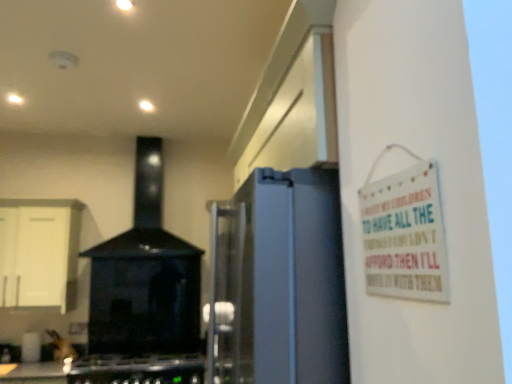
Question: Is black glossy stove at center beside black matte gas stove at lower left?

Choices:
 (A) no
 (B) yes

Answer: (A)

Question: Does black glossy stove at center have a lesser width compared to black matte gas stove at lower left?

Choices:
 (A) no
 (B) yes

Answer: (B)

Question: Is black glossy stove at center outside black matte gas stove at lower left?

Choices:
 (A) yes
 (B) no

Answer: (A)

Question: Can you confirm if black glossy stove at center is bigger than black matte gas stove at lower left?

Choices:
 (A) no
 (B) yes

Answer: (B)

Question: Is the depth of black glossy stove at center greater than that of black matte gas stove at lower left?

Choices:
 (A) yes
 (B) no

Answer: (A)

Question: Looking at their shapes, would you say black glossy stove at center is wider or thinner than black matte gas stove at lower left?

Choices:
 (A) thin
 (B) wide

Answer: (A)

Question: Considering the positions of black glossy stove at center and black matte gas stove at lower left in the image, is black glossy stove at center bigger or smaller than black matte gas stove at lower left?

Choices:
 (A) big
 (B) small

Answer: (A)

Question: Is black glossy stove at center taller or shorter than black matte gas stove at lower left?

Choices:
 (A) tall
 (B) short

Answer: (A)

Question: In the image, is black glossy stove at center on the left side or the right side of black matte gas stove at lower left?

Choices:
 (A) right
 (B) left

Answer: (B)

Question: Considering the positions of point (114, 362) and point (139, 286), is point (114, 362) closer or farther from the camera than point (139, 286)?

Choices:
 (A) closer
 (B) farther

Answer: (A)

Question: From their relative heights in the image, would you say black matte gas stove at lower left is taller or shorter than black glossy stove at center?

Choices:
 (A) short
 (B) tall

Answer: (A)

Question: Is black matte gas stove at lower left spatially inside black glossy stove at center, or outside of it?

Choices:
 (A) outside
 (B) inside

Answer: (A)

Question: From the image's perspective, is black matte gas stove at lower left above or below black glossy stove at center?

Choices:
 (A) below
 (B) above

Answer: (A)

Question: In terms of height, does white wooden sign at upper right look taller or shorter compared to white matte cabinet at left?

Choices:
 (A) short
 (B) tall

Answer: (A)

Question: From a real-world perspective, is white wooden sign at upper right positioned above or below white matte cabinet at left?

Choices:
 (A) above
 (B) below

Answer: (B)